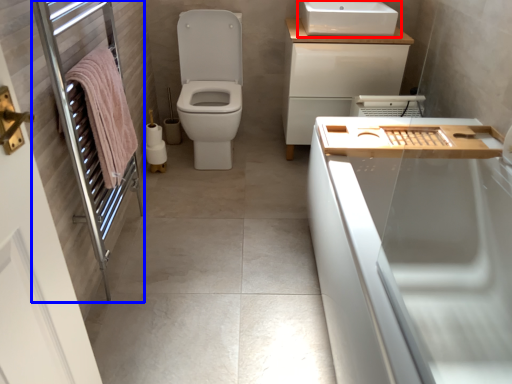
Question: Which of the following is the farthest to the observer, sink (highlighted by a red box) or screen door (highlighted by a blue box)?

Choices:
 (A) sink
 (B) screen door

Answer: (A)